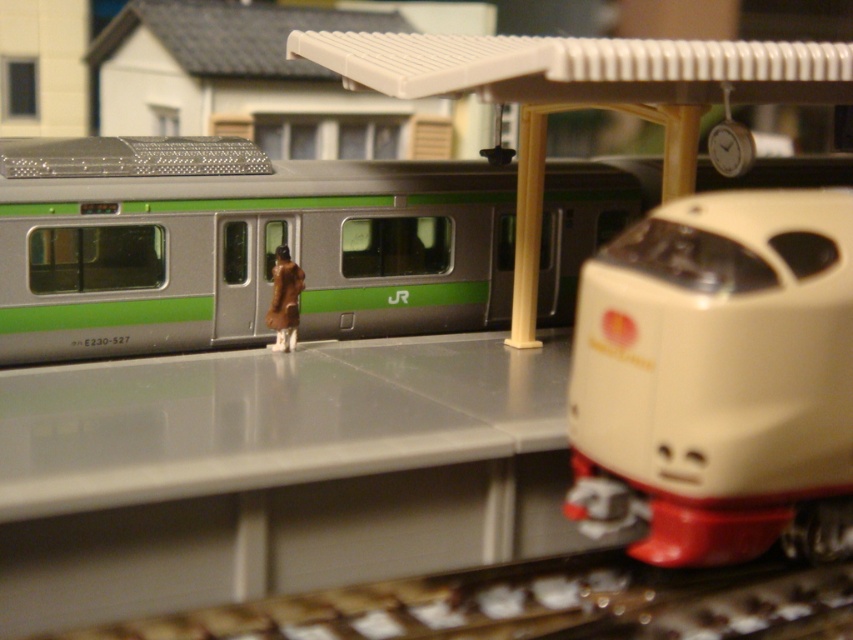
Question: Among these points, which one is farthest from the camera?

Choices:
 (A) (281, 291)
 (B) (490, 292)

Answer: (B)

Question: Is metallic silver train at center above brown fur coat at center?

Choices:
 (A) no
 (B) yes

Answer: (B)

Question: Estimate the real-world distances between objects in this image. Which object is closer to the brown fur coat at center?

Choices:
 (A) beige plastic train at center
 (B) metallic silver train at center

Answer: (B)

Question: Does beige plastic train at center lie behind brown fur coat at center?

Choices:
 (A) yes
 (B) no

Answer: (B)

Question: Based on their relative distances, which object is nearer to the brown fur coat at center?

Choices:
 (A) beige plastic train at center
 (B) metallic silver train at center

Answer: (B)

Question: Does metallic silver train at center have a lesser width compared to beige plastic train at center?

Choices:
 (A) yes
 (B) no

Answer: (B)